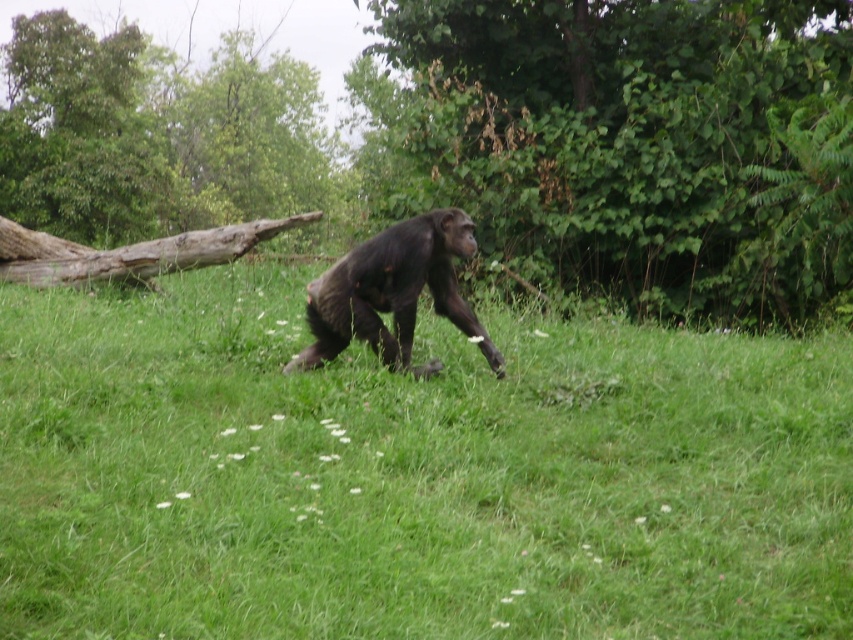
Question: Is green grassy at center above brown wood log at left?

Choices:
 (A) no
 (B) yes

Answer: (A)

Question: Estimate the real-world distances between objects in this image. Which object is closer to the green grassy at center?

Choices:
 (A) shiny black monkey at center
 (B) green leafy tree at center
 (C) brown wood log at left

Answer: (A)

Question: Does brown wood log at left have a larger size compared to shiny black monkey at center?

Choices:
 (A) yes
 (B) no

Answer: (A)

Question: Can you confirm if brown wood log at left is positioned to the left of shiny black monkey at center?

Choices:
 (A) no
 (B) yes

Answer: (B)

Question: Which point is closer to the camera?

Choices:
 (A) (537, 474)
 (B) (212, 186)
 (C) (628, 93)

Answer: (A)

Question: Which object appears farthest from the camera in this image?

Choices:
 (A) brown wood log at left
 (B) green grassy at center
 (C) green leafy tree at center
 (D) shiny black monkey at center

Answer: (A)